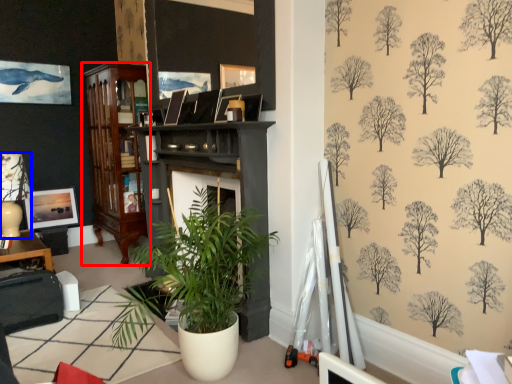
Question: Among these objects, which one is farthest to the camera, cabinetry (highlighted by a red box) or lamp (highlighted by a blue box)?

Choices:
 (A) cabinetry
 (B) lamp

Answer: (A)